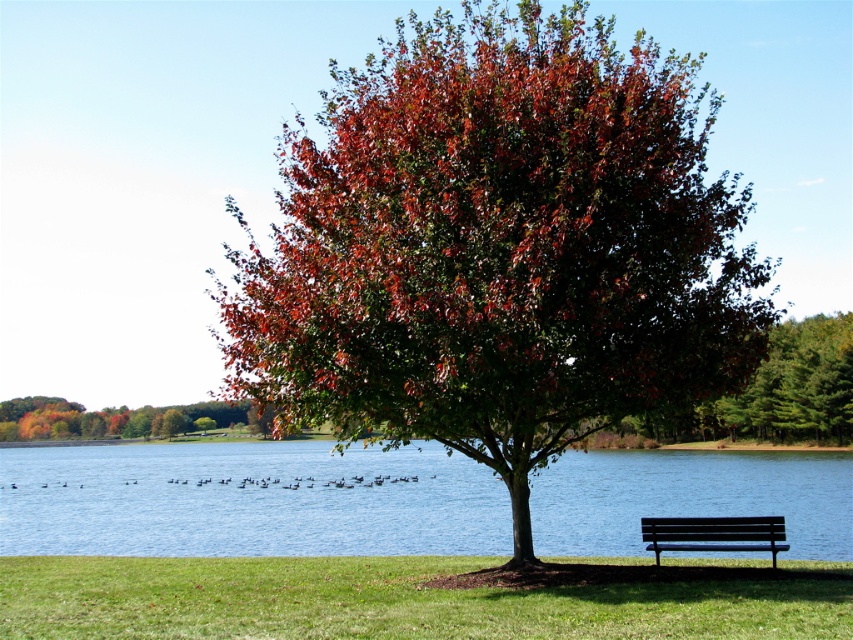
Between shiny reddish-brown leaves at center and black metal bench at lower right, which one is positioned higher?

shiny reddish-brown leaves at center

In order to click on shiny reddish-brown leaves at center in this screenshot , I will do `click(498, 248)`.

Who is more forward, (643, 58) or (670, 547)?

Point (670, 547) is in front.

The height and width of the screenshot is (640, 853). What are the coordinates of `shiny reddish-brown leaves at center` in the screenshot? It's located at (498, 248).

Is point (704, 253) less distant than point (608, 509)?

Yes, it is in front of point (608, 509).

Does point (519, 554) lie behind point (405, 486)?

No, (519, 554) is in front of (405, 486).

Which is in front, point (488, 152) or point (163, 552)?

Point (488, 152) is more forward.

This screenshot has width=853, height=640. I want to click on shiny reddish-brown leaves at center, so click(498, 248).

Is blue water at lower center to the left of black metal bench at lower right from the viewer's perspective?

Correct, you'll find blue water at lower center to the left of black metal bench at lower right.

How far apart are blue water at lower center and black metal bench at lower right?

They are 39.40 meters apart.

Where is `blue water at lower center`? blue water at lower center is located at coordinates (247, 500).